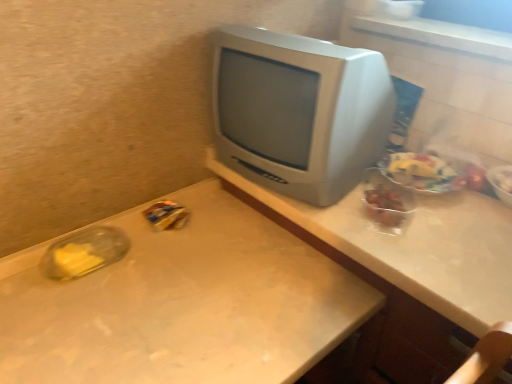
You are a GUI agent. You are given a task and a screenshot of the screen. Output one action in this format:
    pyautogui.click(x=<x>, y=<y>)
    Task: Click on the translucent plastic container at right, which is counted as the third food, starting from the right
    
    Given the screenshot: What is the action you would take?
    pyautogui.click(x=385, y=206)

What is the approximate width of matte gray computer desk at center?

matte gray computer desk at center is 53.50 centimeters in width.

This screenshot has width=512, height=384. I want to click on satin silver monitor at center, so click(298, 111).

What are the coordinates of `translucent plastic bag at right, which is the 2th food in right-to-left order` in the screenshot? It's located at coord(422,172).

What is the approximate width of translucent plastic bag at right, which is the 2th food in right-to-left order?

translucent plastic bag at right, which is the 2th food in right-to-left order, is 6.32 inches in width.

Measure the distance between point (157, 209) and camera.

Point (157, 209) and camera are 3.67 feet apart.

You are a GUI agent. You are given a task and a screenshot of the screen. Output one action in this format:
    pyautogui.click(x=<x>, y=<y>)
    Task: Click on the yellow plastic bag at center-left, which appears as the 4th food when viewed from the right
    
    Given the screenshot: What is the action you would take?
    pyautogui.click(x=166, y=216)

Find the location of a particular element. This screenshot has height=384, width=512. translucent plastic container at right, which is counted as the third food, starting from the right is located at coordinates (385, 206).

Find the location of `glass jar on the left of the translucent plastic bag at right, which is the third food in left-to-right order`. glass jar on the left of the translucent plastic bag at right, which is the third food in left-to-right order is located at coordinates (84, 252).

Is translucent plastic bag at right, which is the third food in left-to-right order, smaller than clear plastic container at left?

No.

Which object is thinner, translucent plastic bag at right, which is the third food in left-to-right order, or clear plastic container at left?

Thinner between the two is clear plastic container at left.

Is the position of white matte desk at center more distant than that of satin silver monitor at center?

That is False.

Does point (169, 305) lie in front of point (294, 56)?

No, it is behind (294, 56).

From a real-world perspective, is white matte desk at center on top of satin silver monitor at center?

No, from a real-world perspective, white matte desk at center is not above satin silver monitor at center.

Is white matte desk at center bigger than satin silver monitor at center?

Correct, white matte desk at center is larger in size than satin silver monitor at center.

Is point (180, 217) positioned behind point (399, 157)?

Yes.

Can you confirm if yellow plastic bag at center-left, which appears as the 4th food when viewed from the right, is bigger than translucent plastic bag at right, which is the 2th food in right-to-left order?

Actually, yellow plastic bag at center-left, which appears as the 4th food when viewed from the right, might be smaller than translucent plastic bag at right, which is the 2th food in right-to-left order.

From a real-world perspective, starting from the yellow plastic bag at center-left, which appears as the 4th food when viewed from the right, which food is the 3rd one vertically above it? Please provide its 2D coordinates.

[(422, 172)]

Is white matte desk at center taller than translucent plastic bowl at upper right, the 1th food in the right-to-left sequence?

Indeed, white matte desk at center has a greater height compared to translucent plastic bowl at upper right, the 1th food in the right-to-left sequence.

Locate an element on the screen. desk lying in front of the translucent plastic bowl at upper right, the 1th food in the right-to-left sequence is located at coordinates (182, 304).

Is white matte desk at center in front of or behind translucent plastic bowl at upper right, the fourth food in the left-to-right sequence, in the image?

Visually, white matte desk at center is located in front of translucent plastic bowl at upper right, the fourth food in the left-to-right sequence.

Is white matte desk at center spatially inside translucent plastic bowl at upper right, the 1th food in the right-to-left sequence, or outside of it?

The correct answer is: outside.

Is point (463, 278) closer to viewer compared to point (292, 377)?

No, (463, 278) is behind (292, 377).

From a real-world perspective, is matte gray computer desk at center above or below white matte desk at center?

From a real-world perspective, matte gray computer desk at center is physically above white matte desk at center.

Are matte gray computer desk at center and white matte desk at center located far from each other?

No.

Considering the sizes of matte gray computer desk at center and white matte desk at center in the image, is matte gray computer desk at center bigger or smaller than white matte desk at center?

matte gray computer desk at center is bigger than white matte desk at center.

Is white matte desk at center turned away from translucent plastic container at right, which appears as the 2th food when viewed from the left?

white matte desk at center is not turned away from translucent plastic container at right, which appears as the 2th food when viewed from the left.

From a real-world perspective, is white matte desk at center on translucent plastic container at right, which appears as the 2th food when viewed from the left?

No, from a real-world perspective, white matte desk at center is not on top of translucent plastic container at right, which appears as the 2th food when viewed from the left.

Based on their sizes in the image, would you say white matte desk at center is bigger or smaller than translucent plastic container at right, which is counted as the third food, starting from the right?

Considering their sizes, white matte desk at center takes up more space than translucent plastic container at right, which is counted as the third food, starting from the right.

Can you see white matte desk at center touching translucent plastic container at right, which appears as the 2th food when viewed from the left?

No.

Is translucent plastic bowl at upper right, the 1th food in the right-to-left sequence, to the left of white matte desk at center from the viewer's perspective?

Incorrect, translucent plastic bowl at upper right, the 1th food in the right-to-left sequence, is not on the left side of white matte desk at center.

Could you tell me if translucent plastic bowl at upper right, the fourth food in the left-to-right sequence, is facing white matte desk at center?

No, translucent plastic bowl at upper right, the fourth food in the left-to-right sequence, does not turn towards white matte desk at center.

Is translucent plastic bowl at upper right, the fourth food in the left-to-right sequence, wider than white matte desk at center?

No.

Is translucent plastic bowl at upper right, the 1th food in the right-to-left sequence, in front of white matte desk at center?

No, translucent plastic bowl at upper right, the 1th food in the right-to-left sequence, is further to the viewer.

Locate an element on the screen. The image size is (512, 384). glass jar in front of the translucent plastic bag at right, which is the third food in left-to-right order is located at coordinates (84, 252).

You are a GUI agent. You are given a task and a screenshot of the screen. Output one action in this format:
    pyautogui.click(x=<x>, y=<y>)
    Task: Click on the desk that appears below the satin silver monitor at center (from the image's perspective)
    This screenshot has height=384, width=512.
    Given the screenshot: What is the action you would take?
    pyautogui.click(x=182, y=304)

From the image, which object appears to be nearer to white matte desk at center, satin silver monitor at center or clear plastic container at left?

clear plastic container at left is closer to white matte desk at center.

Which object lies further to the anchor point translucent plastic bowl at upper right, the fourth food in the left-to-right sequence, translucent plastic bag at right, which is the third food in left-to-right order, or white matte desk at center?

white matte desk at center is positioned further to the anchor translucent plastic bowl at upper right, the fourth food in the left-to-right sequence.

Considering their positions, is satin silver monitor at center positioned closer to clear plastic container at left than white matte desk at center?

Based on the image, white matte desk at center appears to be nearer to clear plastic container at left.

From the picture: Which object lies further to the anchor point satin silver monitor at center, white matte desk at center or translucent plastic bowl at upper right, the fourth food in the left-to-right sequence?

Among the two, translucent plastic bowl at upper right, the fourth food in the left-to-right sequence, is located further to satin silver monitor at center.

Estimate the real-world distances between objects in this image. Which object is further from clear plastic container at left, translucent plastic bowl at upper right, the fourth food in the left-to-right sequence, or translucent plastic container at right, which appears as the 2th food when viewed from the left?

Based on the image, translucent plastic bowl at upper right, the fourth food in the left-to-right sequence, appears to be further to clear plastic container at left.

Based on their spatial positions, is translucent plastic bowl at upper right, the 1th food in the right-to-left sequence, or yellow plastic bag at center-left, which is counted as the first food, starting from the left, closer to clear plastic container at left?

The object closer to clear plastic container at left is yellow plastic bag at center-left, which is counted as the first food, starting from the left.

Considering their positions, is translucent plastic bowl at upper right, the 1th food in the right-to-left sequence, positioned closer to matte gray computer desk at center than satin silver monitor at center?

satin silver monitor at center is positioned closer to the anchor matte gray computer desk at center.

From the image, which object appears to be farther from white matte desk at center, yellow plastic bag at center-left, which is counted as the first food, starting from the left, or translucent plastic bag at right, which is the 2th food in right-to-left order?

translucent plastic bag at right, which is the 2th food in right-to-left order, is positioned further to the anchor white matte desk at center.

Locate an element on the screen. This screenshot has width=512, height=384. desk between clear plastic container at left and matte gray computer desk at center from left to right is located at coordinates (182, 304).

You are a GUI agent. You are given a task and a screenshot of the screen. Output one action in this format:
    pyautogui.click(x=<x>, y=<y>)
    Task: Click on the food located between yellow plastic bag at center-left, which is counted as the first food, starting from the left, and matte gray computer desk at center in the left-right direction
    
    Given the screenshot: What is the action you would take?
    pyautogui.click(x=385, y=206)

Where is `computer desk situated between yellow plastic bag at center-left, which appears as the 4th food when viewed from the right, and translucent plastic bowl at upper right, the fourth food in the left-to-right sequence, from left to right`? computer desk situated between yellow plastic bag at center-left, which appears as the 4th food when viewed from the right, and translucent plastic bowl at upper right, the fourth food in the left-to-right sequence, from left to right is located at coordinates (417, 248).

Image resolution: width=512 pixels, height=384 pixels. In order to click on food between translucent plastic container at right, which appears as the 2th food when viewed from the left, and translucent plastic bowl at upper right, the 1th food in the right-to-left sequence, from left to right in this screenshot , I will do `click(422, 172)`.